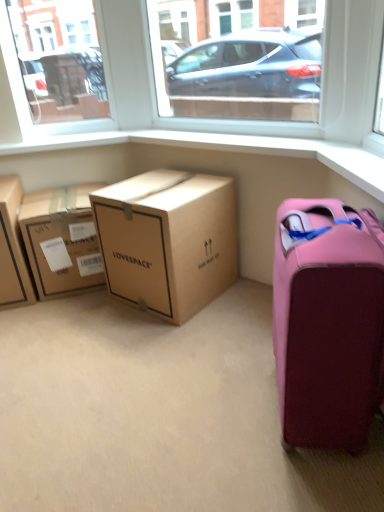
Question: Is pink matte suitcase at lower right not near brown cardboard box at center, which appears as the second box when viewed from the right?

Choices:
 (A) no
 (B) yes

Answer: (B)

Question: Is pink matte suitcase at lower right wider than brown cardboard box at center, which is the second box in left-to-right order?

Choices:
 (A) yes
 (B) no

Answer: (B)

Question: From the image's perspective, is pink matte suitcase at lower right below brown cardboard box at center, which appears as the second box when viewed from the right?

Choices:
 (A) no
 (B) yes

Answer: (B)

Question: Considering the relative positions of pink matte suitcase at lower right and brown cardboard box at center, which appears as the second box when viewed from the right, in the image provided, is pink matte suitcase at lower right to the right of brown cardboard box at center, which appears as the second box when viewed from the right, from the viewer's perspective?

Choices:
 (A) yes
 (B) no

Answer: (A)

Question: Does pink matte suitcase at lower right appear on the left side of brown cardboard box at center, which is the second box in left-to-right order?

Choices:
 (A) no
 (B) yes

Answer: (A)

Question: Is brown cardboard box at center, which is the second box in left-to-right order, inside or outside of matte brown cardboard box at left, the third box from the right?

Choices:
 (A) outside
 (B) inside

Answer: (A)

Question: Considering the positions of brown cardboard box at center, which is the second box in left-to-right order, and matte brown cardboard box at left, arranged as the 1th box when viewed from the left, in the image, is brown cardboard box at center, which is the second box in left-to-right order, bigger or smaller than matte brown cardboard box at left, arranged as the 1th box when viewed from the left,?

Choices:
 (A) small
 (B) big

Answer: (B)

Question: From the image's perspective, is brown cardboard box at center, which appears as the second box when viewed from the right, above or below matte brown cardboard box at left, arranged as the 1th box when viewed from the left?

Choices:
 (A) below
 (B) above

Answer: (B)

Question: From a real-world perspective, is brown cardboard box at center, which appears as the second box when viewed from the right, above or below matte brown cardboard box at left, arranged as the 1th box when viewed from the left?

Choices:
 (A) below
 (B) above

Answer: (A)

Question: In terms of size, does pink matte suitcase at lower right appear bigger or smaller than transparent glass window at upper center, which ranks as the 2th window screen in left-to-right order?

Choices:
 (A) small
 (B) big

Answer: (B)

Question: Is point (377, 226) closer or farther from the camera than point (266, 27)?

Choices:
 (A) closer
 (B) farther

Answer: (A)

Question: From their relative heights in the image, would you say pink matte suitcase at lower right is taller or shorter than transparent glass window at upper center, which ranks as the 2th window screen in left-to-right order?

Choices:
 (A) tall
 (B) short

Answer: (A)

Question: From a real-world perspective, is pink matte suitcase at lower right physically located above or below transparent glass window at upper center, which ranks as the 2th window screen in left-to-right order?

Choices:
 (A) below
 (B) above

Answer: (A)

Question: Considering the positions of transparent glass window at upper center, which ranks as the 2th window screen in left-to-right order, and transparent glass window at upper left, the 1th window screen positioned from the left, in the image, is transparent glass window at upper center, which ranks as the 2th window screen in left-to-right order, bigger or smaller than transparent glass window at upper left, the 1th window screen positioned from the left,?

Choices:
 (A) small
 (B) big

Answer: (B)

Question: From a real-world perspective, is transparent glass window at upper center, which ranks as the first window screen in right-to-left order, positioned above or below transparent glass window at upper left, which is counted as the second window screen, starting from the right?

Choices:
 (A) above
 (B) below

Answer: (B)